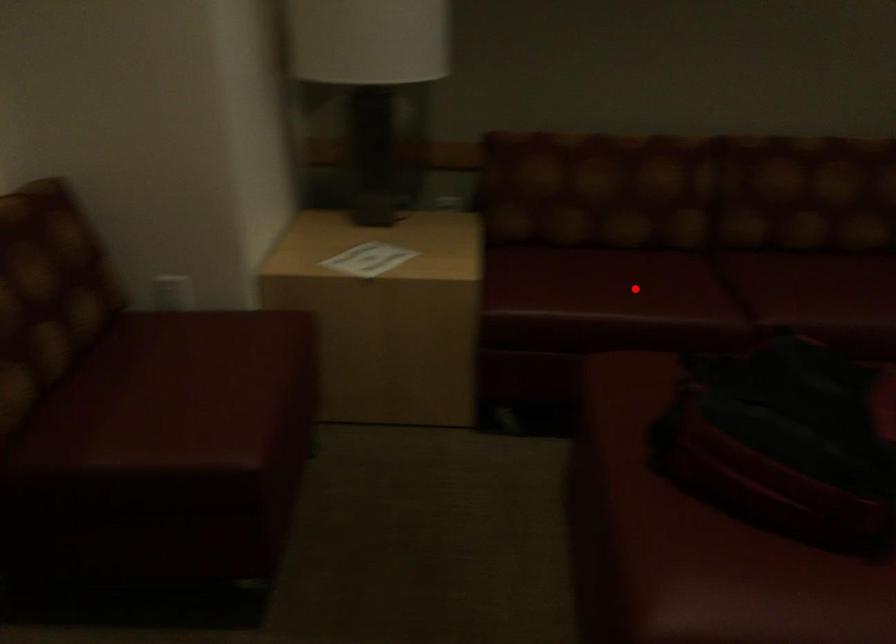
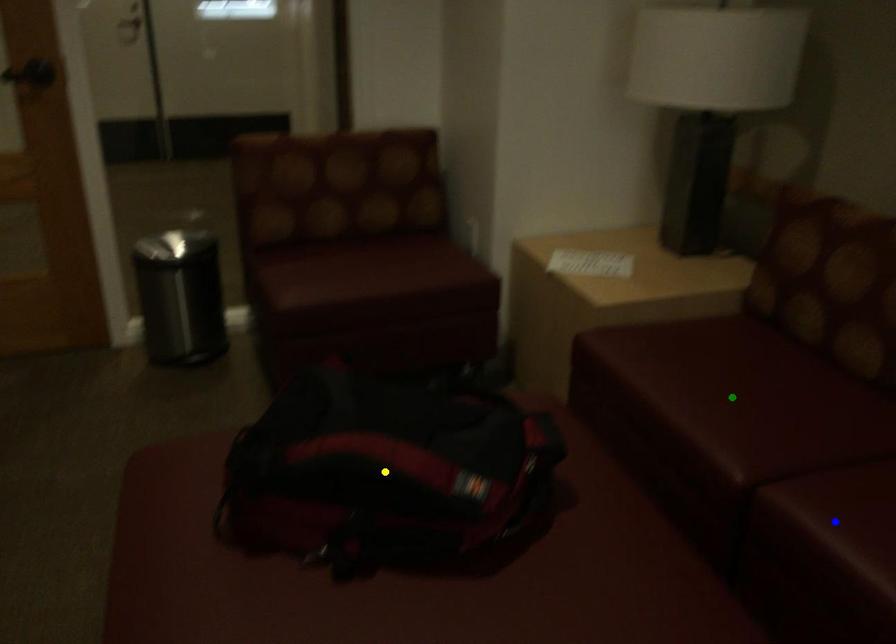
Question: I am providing you with two images of the same scene from different viewpoints. A red point is marked on the first image. You are given multiple points on the second image. Which mark in image 2 goes with the point in image 1?

Choices:
 (A) green point
 (B) blue point
 (C) yellow point

Answer: (A)